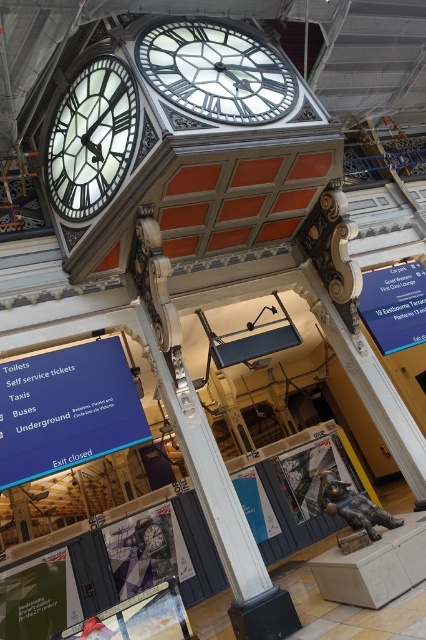
Question: Considering the real-world distances, which object is closest to the blue plastic sign at center right?

Choices:
 (A) white paper at center
 (B) white glass clock at upper center

Answer: (B)

Question: Is blue plastic sign at center right closer to the viewer compared to bronze statue at lower right?

Choices:
 (A) no
 (B) yes

Answer: (A)

Question: Can you confirm if green paper at lower left is bigger than matte black sign at center?

Choices:
 (A) yes
 (B) no

Answer: (B)

Question: Which point is closer to the camera?

Choices:
 (A) (74, 592)
 (B) (233, 477)
 (C) (414, 340)
 (D) (328, 506)

Answer: (D)

Question: Can you confirm if matte black sign at center is wider than bronze statue at lower right?

Choices:
 (A) yes
 (B) no

Answer: (A)

Question: Which point is farther to the camera?

Choices:
 (A) white glossy clock at upper left
 (B) blue matte sign at lower left
 (C) white glass clock at upper center
 (D) blue plastic sign at center right

Answer: (D)